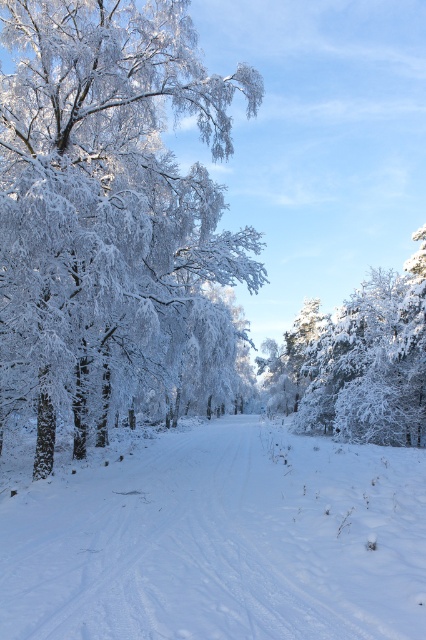
You are a hiker trying to cross the snow covered road. You see the white snow at center and the white frosty tree at right. Which object is closer to the left side of the road?

The white snow at center is closer to the left side of the road than the white frosty tree at right.